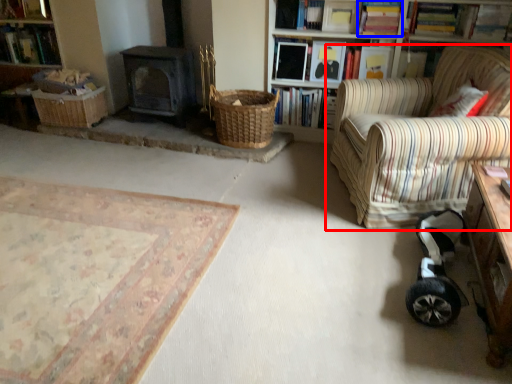
Question: Which of the following is the farthest to the observer, chair (highlighted by a red box) or book (highlighted by a blue box)?

Choices:
 (A) chair
 (B) book

Answer: (B)